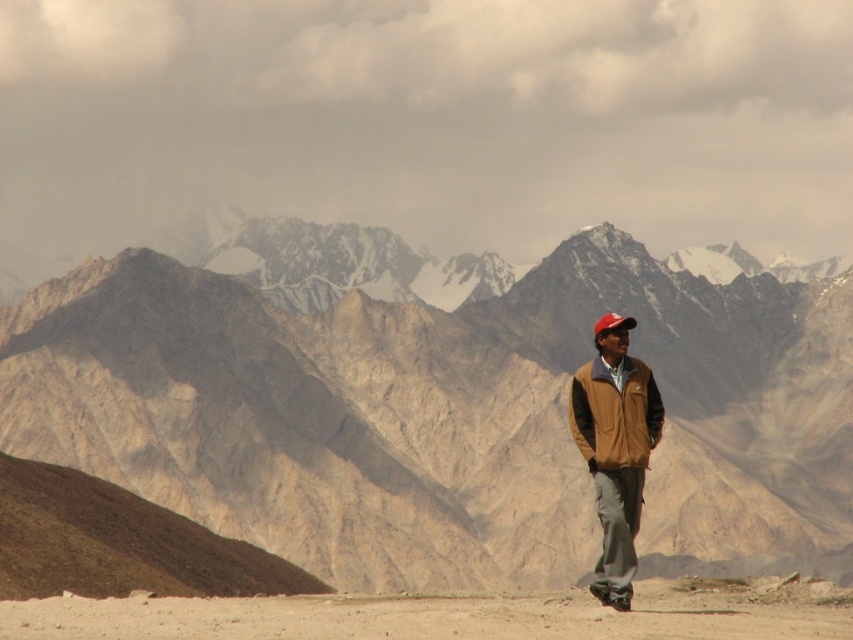
Is rugged stone mountain range at center in front of brown suede jacket at center?

No, it is not.

Can you confirm if rugged stone mountain range at center is positioned to the left of brown suede jacket at center?

In fact, rugged stone mountain range at center is to the right of brown suede jacket at center.

Who is more forward, (230, 458) or (630, 486)?

Point (630, 486) is in front.

Find the location of a particular element. The image size is (853, 640). rugged stone mountain range at center is located at coordinates (440, 412).

Can you confirm if brown suede jacket at center is positioned to the right of brown fleece jacket at lower right?

Incorrect, brown suede jacket at center is not on the right side of brown fleece jacket at lower right.

Does brown suede jacket at center have a greater height compared to brown fleece jacket at lower right?

Yes, brown suede jacket at center is taller than brown fleece jacket at lower right.

Measure the distance between brown suede jacket at center and camera.

brown suede jacket at center and camera are 163.59 meters apart from each other.

This screenshot has height=640, width=853. In order to click on brown suede jacket at center in this screenshot , I will do `click(614, 452)`.

Can you confirm if brown suede jacket at center is positioned to the right of red matte cap at center?

Incorrect, brown suede jacket at center is not on the right side of red matte cap at center.

Who is lower down, brown suede jacket at center or red matte cap at center?

brown suede jacket at center

Is point (607, 483) farther from camera compared to point (608, 320)?

No, (607, 483) is in front of (608, 320).

Identify the location of brown suede jacket at center. (614, 452).